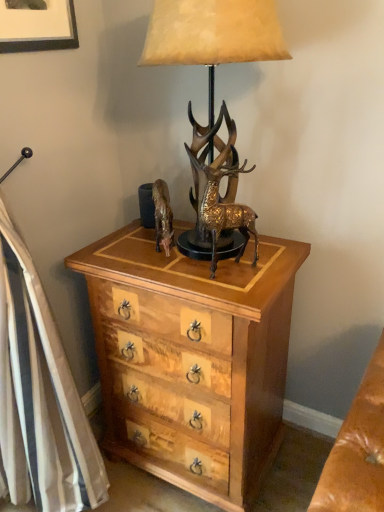
The image size is (384, 512). In order to click on free point behind gold textured deer at center in this screenshot , I will do `click(241, 253)`.